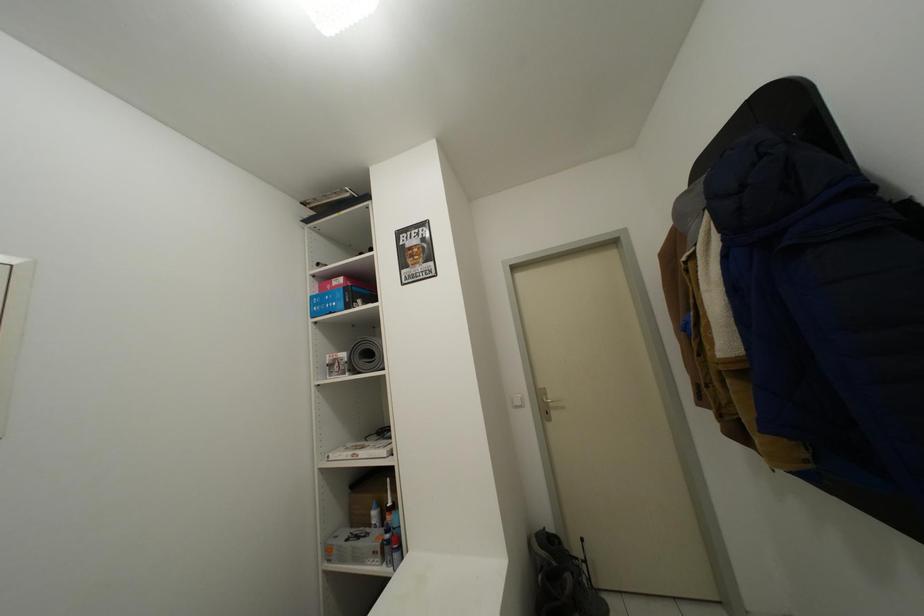
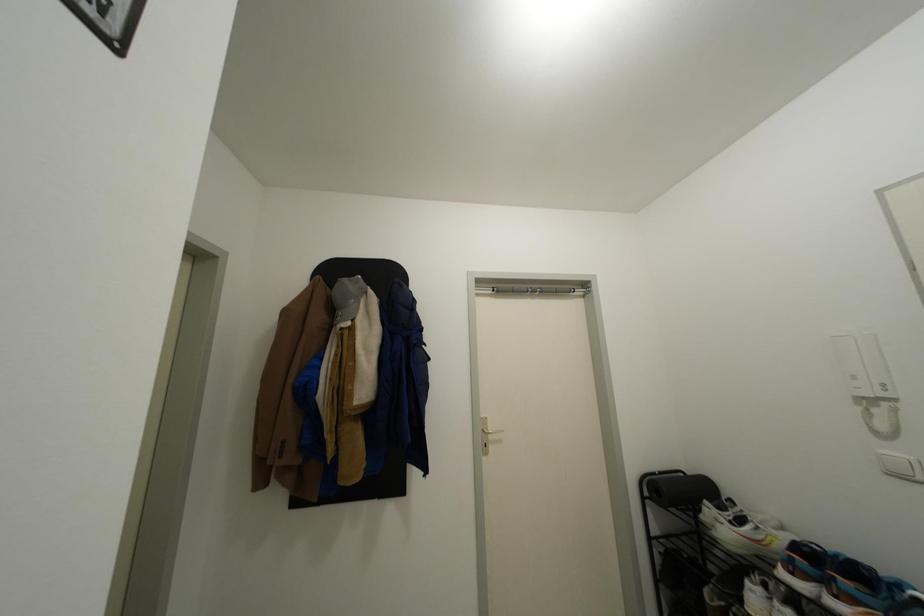
The images are taken continuously from a first-person perspective. In which direction is your viewpoint rotating?

The rotation direction of the camera is right-up.